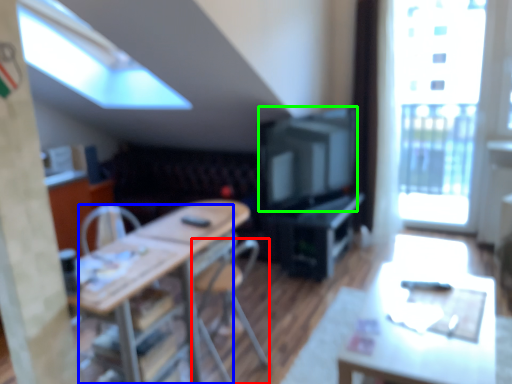
Question: Which is farther away from chair (highlighted by a red box)? chair (highlighted by a blue box) or television (highlighted by a green box)?

Choices:
 (A) chair
 (B) television

Answer: (B)